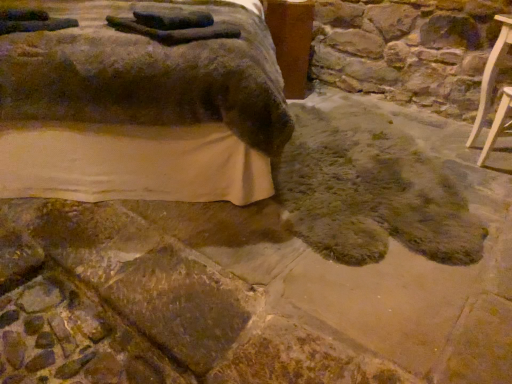
Identify the location of free space behind light wood chair at right, which is the second furniture in left-to-right order. The width and height of the screenshot is (512, 384). (484, 159).